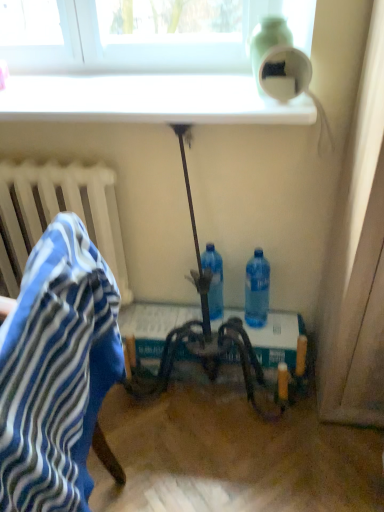
The image size is (384, 512). In order to click on unoccupied area in front of metallic silver table at center in this screenshot , I will do `click(237, 464)`.